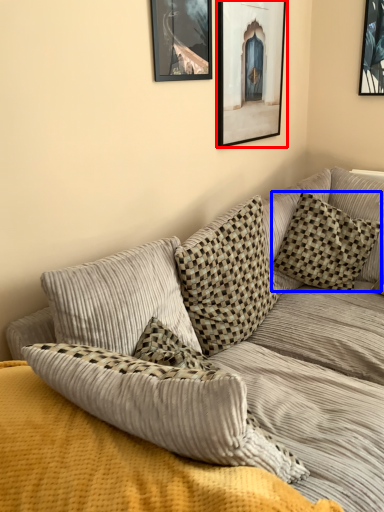
Question: Which of the following is the farthest to the observer, picture frame (highlighted by a red box) or pillow (highlighted by a blue box)?

Choices:
 (A) picture frame
 (B) pillow

Answer: (B)